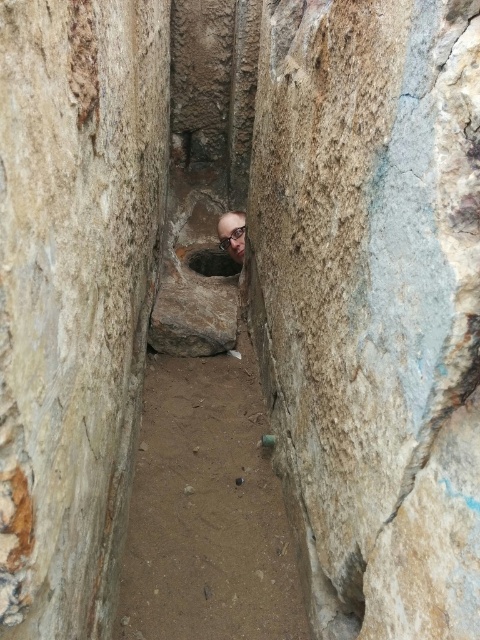
Question: Does smooth stone hole at center appear on the left side of smooth bald head at center?

Choices:
 (A) no
 (B) yes

Answer: (B)

Question: Does rough stone wall at center lie behind smooth bald head at center?

Choices:
 (A) no
 (B) yes

Answer: (A)

Question: Which is nearer to the smooth stone hole at center?

Choices:
 (A) smooth bald head at center
 (B) rough stone wall at center

Answer: (A)

Question: Which of the following is the closest to the observer?

Choices:
 (A) smooth bald head at center
 (B) smooth stone hole at center

Answer: (A)

Question: Does rough stone wall at center appear on the left side of smooth bald head at center?

Choices:
 (A) yes
 (B) no

Answer: (B)

Question: Among these objects, which one is farthest from the camera?

Choices:
 (A) rough stone wall at center
 (B) smooth bald head at center
 (C) smooth stone hole at center

Answer: (C)